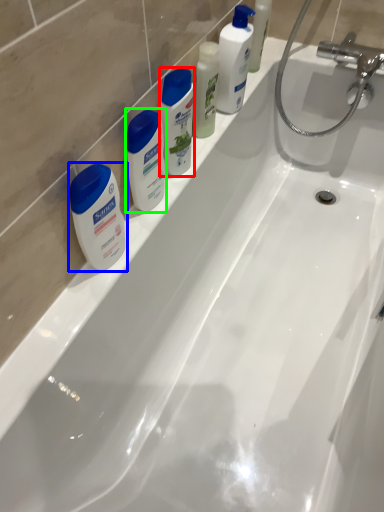
Question: Which object is the closest to the cleaning product (highlighted by a red box)? Choose among these: toiletry (highlighted by a blue box) or toiletry (highlighted by a green box).

Choices:
 (A) toiletry
 (B) toiletry

Answer: (B)